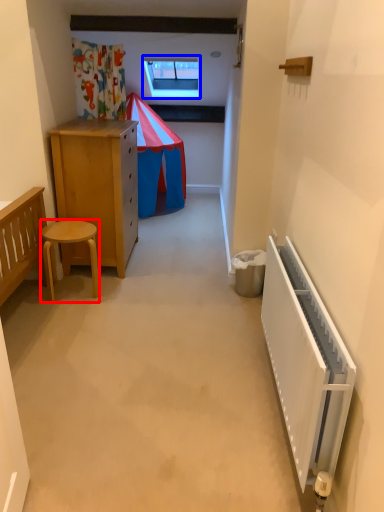
Question: Among these objects, which one is farthest to the camera, stool (highlighted by a red box) or window (highlighted by a blue box)?

Choices:
 (A) stool
 (B) window

Answer: (B)